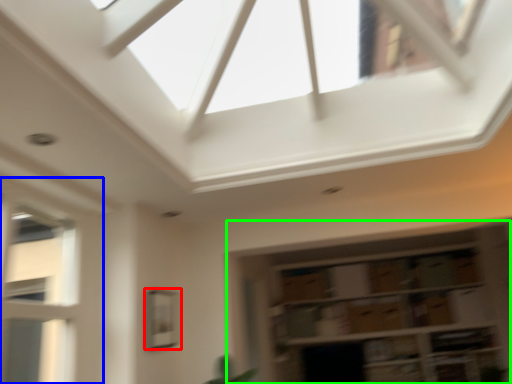
Question: Estimate the real-world distances between objects in this image. Which object is farther from window (highlighted by a red box), window (highlighted by a blue box) or shelf (highlighted by a green box)?

Choices:
 (A) window
 (B) shelf

Answer: (B)